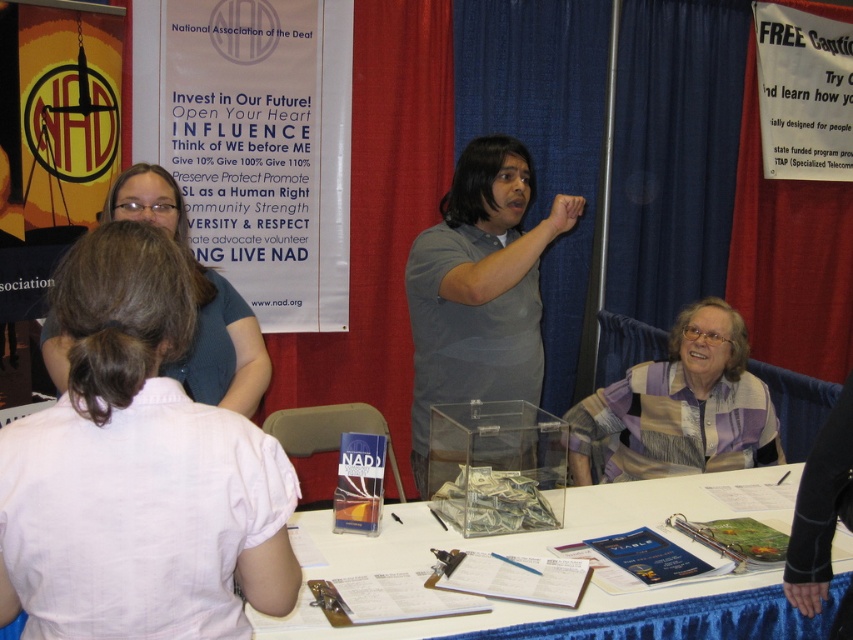
Question: Does clear plastic table at center have a larger size compared to striped sweater at lower right?

Choices:
 (A) yes
 (B) no

Answer: (A)

Question: In this image, where is pink fabric shirt at upper left located relative to clear plastic table at center?

Choices:
 (A) above
 (B) below

Answer: (A)

Question: Which is nearer to the clear plastic table at center?

Choices:
 (A) matte blue shirt at upper left
 (B) gray cotton shirt at center

Answer: (B)

Question: Which point is farther from the camera taking this photo?

Choices:
 (A) (534, 380)
 (B) (764, 576)

Answer: (A)

Question: Can you confirm if gray cotton shirt at center is bigger than striped sweater at lower right?

Choices:
 (A) yes
 (B) no

Answer: (A)

Question: Which object is closer to the camera taking this photo?

Choices:
 (A) striped sweater at lower right
 (B) gray cotton shirt at center
 (C) clear plastic table at center
 (D) matte blue shirt at upper left

Answer: (C)